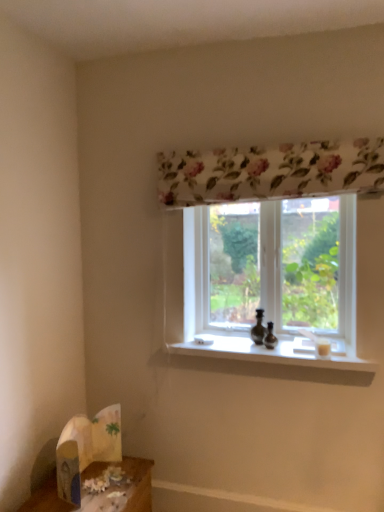
What do you see at coordinates (140, 482) in the screenshot? Image resolution: width=384 pixels, height=512 pixels. I see `wooden table at lower left` at bounding box center [140, 482].

What is the approximate width of white smooth window sill at center?

white smooth window sill at center is 11.72 inches in width.

Find the location of a particular element. This screenshot has width=384, height=512. white smooth window sill at center is located at coordinates coord(264,356).

Where is `wooden table at lower left`? Image resolution: width=384 pixels, height=512 pixels. wooden table at lower left is located at coordinates (140, 482).

Who is smaller, white paper bag at lower left or transparent glass window at center?

With smaller size is white paper bag at lower left.

Which is farther, [74,440] or [204,255]?

Positioned behind is point [204,255].

Does white paper bag at lower left appear on the left side of transparent glass window at center?

Indeed, white paper bag at lower left is positioned on the left side of transparent glass window at center.

Is white paper bag at lower left not within transparent glass window at center?

Absolutely, white paper bag at lower left is external to transparent glass window at center.

From the image's perspective, is wooden table at lower left located above or below white paper bag at lower left?

From the image's perspective, wooden table at lower left appears below white paper bag at lower left.

Which object is further away from the camera, wooden table at lower left or white paper bag at lower left?

Positioned behind is white paper bag at lower left.

Is wooden table at lower left at the right side of white paper bag at lower left?

Yes.

You are a GUI agent. You are given a task and a screenshot of the screen. Output one action in this format:
    pyautogui.click(x=<x>, y=<y>)
    Task: Click on the cardboard box on the left of the wooden table at lower left
    
    Given the screenshot: What is the action you would take?
    pyautogui.click(x=86, y=449)

Locate an element on the screen. table below the white smooth window sill at center (from a real-world perspective) is located at coordinates (140, 482).

Is white smooth window sill at center thinner than wooden table at lower left?

Yes, white smooth window sill at center is thinner than wooden table at lower left.

In the scene shown: Who is shorter, white smooth window sill at center or wooden table at lower left?

white smooth window sill at center is shorter.

Which object is positioned more to the left, white smooth window sill at center or wooden table at lower left?

Positioned to the left is wooden table at lower left.

From a real-world perspective, is wooden table at lower left positioned over transparent glass window at center based on gravity?

Incorrect, from a real-world perspective, wooden table at lower left is lower than transparent glass window at center.

Is wooden table at lower left oriented towards transparent glass window at center?

No, wooden table at lower left is not oriented towards transparent glass window at center.

Is wooden table at lower left positioned in front of transparent glass window at center?

Yes, wooden table at lower left is in front of transparent glass window at center.

From the picture: Does wooden table at lower left have a greater height compared to transparent glass window at center?

→ No.

Which of these two, transparent glass window at center or wooden table at lower left, is thinner?

With smaller width is transparent glass window at center.

Which is correct: transparent glass window at center is inside wooden table at lower left, or outside of it?

transparent glass window at center is located beyond the bounds of wooden table at lower left.

Does point (279, 211) lie behind point (86, 472)?

That is True.

From a real-world perspective, which object stands above the other?

transparent glass window at center is physically above.

Between point (51, 490) and point (340, 344), which one is positioned behind?

Point (340, 344)

Which object is more forward, wooden table at lower left or white smooth window sill at center?

wooden table at lower left is closer to the camera.

In terms of width, does wooden table at lower left look wider or thinner when compared to white smooth window sill at center?

In the image, wooden table at lower left appears to be wider than white smooth window sill at center.

Considering the sizes of objects wooden table at lower left and white smooth window sill at center in the image provided, who is taller, wooden table at lower left or white smooth window sill at center?

With more height is wooden table at lower left.

Would you say transparent glass window at center contains white paper bag at lower left?

Definitely not — white paper bag at lower left is not inside transparent glass window at center.

Is point (314, 245) behind point (62, 480)?

Yes, it is behind point (62, 480).

Considering the sizes of objects transparent glass window at center and white paper bag at lower left in the image provided, who is shorter, transparent glass window at center or white paper bag at lower left?

white paper bag at lower left is shorter.

From a real-world perspective, is transparent glass window at center above or below white paper bag at lower left?

transparent glass window at center is above white paper bag at lower left.

Where is `window screen above the white paper bag at lower left (from the image's perspective)`? The width and height of the screenshot is (384, 512). window screen above the white paper bag at lower left (from the image's perspective) is located at coordinates (270, 263).

Locate an element on the screen. table located in front of the white paper bag at lower left is located at coordinates (140, 482).

Looking at the image, which one is located further to white paper bag at lower left, transparent glass window at center or white smooth window sill at center?

The object further to white paper bag at lower left is transparent glass window at center.

Based on their spatial positions, is transparent glass window at center or wooden table at lower left closer to white paper bag at lower left?

The object closer to white paper bag at lower left is wooden table at lower left.

From the image, which object appears to be farther from wooden table at lower left, white paper bag at lower left or transparent glass window at center?

The object further to wooden table at lower left is transparent glass window at center.

Estimate the real-world distances between objects in this image. Which object is further from white smooth window sill at center, white paper bag at lower left or transparent glass window at center?

Among the two, white paper bag at lower left is located further to white smooth window sill at center.

Looking at the image, which one is located further to white smooth window sill at center, transparent glass window at center or wooden table at lower left?

wooden table at lower left lies further to white smooth window sill at center than the other object.

Considering their positions, is wooden table at lower left positioned closer to white smooth window sill at center than white paper bag at lower left?

white paper bag at lower left.

Estimate the real-world distances between objects in this image. Which object is further from white smooth window sill at center, white paper bag at lower left or wooden table at lower left?

Based on the image, wooden table at lower left appears to be further to white smooth window sill at center.

Estimate the real-world distances between objects in this image. Which object is closer to wooden table at lower left, transparent glass window at center or white paper bag at lower left?

white paper bag at lower left.

Locate an element on the screen. table situated between white paper bag at lower left and white smooth window sill at center from left to right is located at coordinates (140, 482).

I want to click on window sill between transparent glass window at center and wooden table at lower left in the vertical direction, so click(264, 356).

You are a GUI agent. You are given a task and a screenshot of the screen. Output one action in this format:
    pyautogui.click(x=<x>, y=<y>)
    Task: Click on the window sill between white paper bag at lower left and transparent glass window at center from left to right
    
    Given the screenshot: What is the action you would take?
    pyautogui.click(x=264, y=356)

Locate an element on the screen. This screenshot has height=512, width=384. cardboard box between transparent glass window at center and wooden table at lower left in the vertical direction is located at coordinates (86, 449).